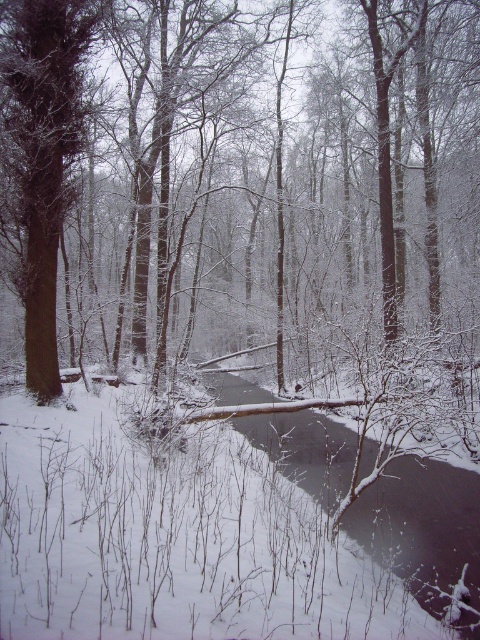
Looking at this image, you are an environmental scientist assessing the forest. You notice the brown smooth tree at center and the brown rough tree at left. Which tree has a wider trunk?

The brown smooth tree at center has a wider trunk than the brown rough tree at left.

You are an animal looking for shelter in the winter forest scene. You see the brown smooth tree at center and the brown rough tree at left. Which tree would you choose if you need a taller tree to build a nest?

The brown smooth tree at center is taller than the brown rough tree at left, so you should choose the brown smooth tree at center to build a nest.